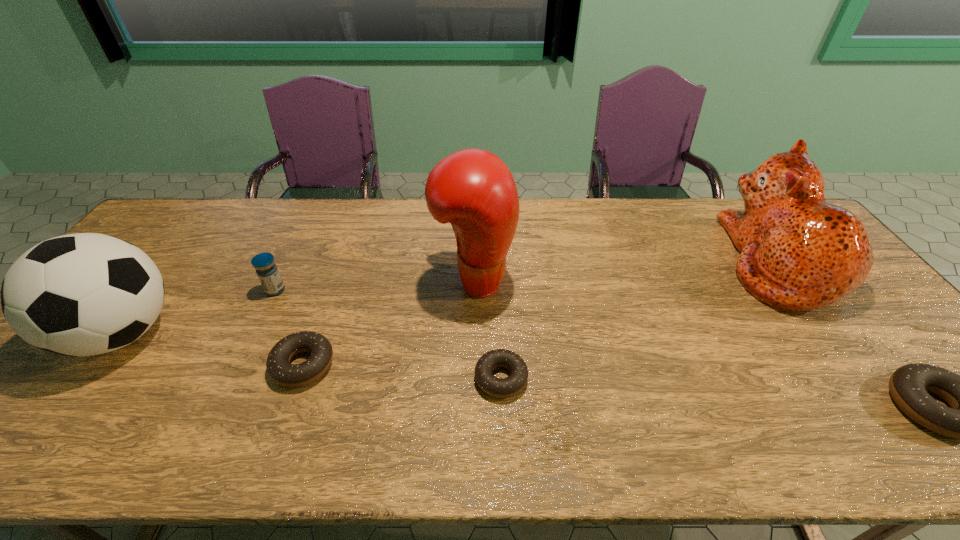
Identify the location of the leftmost doughnut. (278, 365).

You are a GUI agent. You are given a task and a screenshot of the screen. Output one action in this format:
    pyautogui.click(x=<x>, y=<y>)
    Task: Click on the fifth object from right to left
    The height and width of the screenshot is (540, 960).
    Given the screenshot: What is the action you would take?
    pyautogui.click(x=278, y=365)

Identify the location of the shortest doughnut. The height and width of the screenshot is (540, 960). (497, 387).

Find the location of a particular element. the shortest object is located at coordinates (497, 387).

The width and height of the screenshot is (960, 540). Identify the location of the tallest object. (473, 189).

This screenshot has height=540, width=960. Find the location of `cat`. cat is located at coordinates (798, 253).

The height and width of the screenshot is (540, 960). I want to click on medicine, so click(x=266, y=269).

The image size is (960, 540). Find the location of `the fourth tallest object`. the fourth tallest object is located at coordinates (266, 269).

Locate an element on the screen. The image size is (960, 540). soccer ball is located at coordinates (83, 294).

Where is `free space located 0.120m on the back of the fifth object from right to left`? The height and width of the screenshot is (540, 960). free space located 0.120m on the back of the fifth object from right to left is located at coordinates (324, 306).